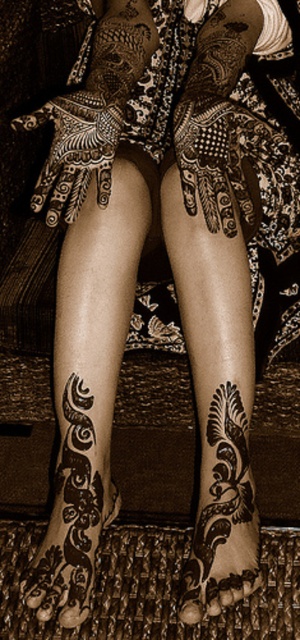
You are a guest at a cultural event and notice two henna designs on the hostess. The brown henna tattoo at lower left and the black henna tattoo at lower center. Which one is taller?

The brown henna tattoo at lower left is taller than the black henna tattoo at lower center.

You are a photographer taking a close up shot of the intricate henna designs on a person. You have a camera focused on the brown henna tattoo at lower left and want to include the woven mat at lower center in your composition. Based on their positions, can you adjust your camera angle to capture both objects in the frame?

The woven mat at lower center is located below the brown henna tattoo at lower left, so tilting the camera downward slightly from the brown henna tattoo at lower left should allow you to include the woven mat at lower center in the frame.